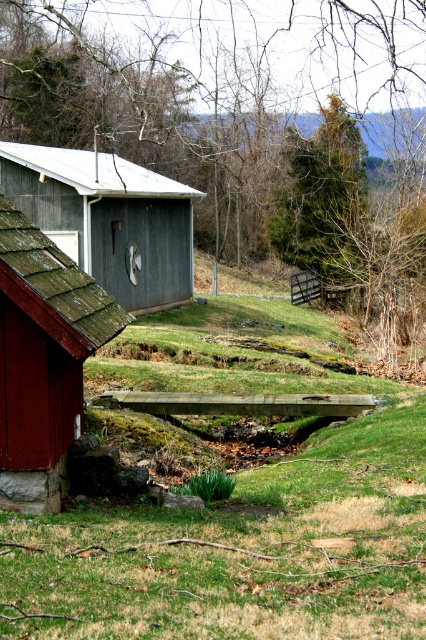
Which is above, rustic wood hut at lower left or green mossy shed at upper left?

green mossy shed at upper left is above.

This screenshot has height=640, width=426. Describe the element at coordinates (43, 358) in the screenshot. I see `rustic wood hut at lower left` at that location.

Where is `rustic wood hut at lower left`? This screenshot has height=640, width=426. rustic wood hut at lower left is located at coordinates (43, 358).